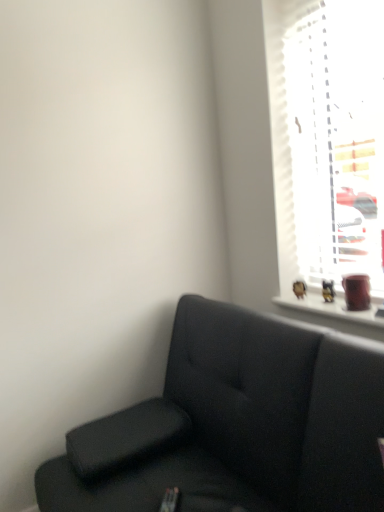
What do you see at coordinates (325, 145) in the screenshot? The height and width of the screenshot is (512, 384). I see `white textured blinds at upper right` at bounding box center [325, 145].

The height and width of the screenshot is (512, 384). I want to click on white textured blinds at upper right, so click(325, 145).

What do you see at coordinates (236, 425) in the screenshot? The height and width of the screenshot is (512, 384). I see `suede black couch at lower right` at bounding box center [236, 425].

Measure the distance between point (225, 342) and camera.

Point (225, 342) is 4.78 feet from camera.

You are a GUI agent. You are given a task and a screenshot of the screen. Output one action in this format:
    pyautogui.click(x=<x>, y=<y>)
    Task: Click on the suede black couch at lower right
    This screenshot has height=512, width=384.
    Given the screenshot: What is the action you would take?
    pyautogui.click(x=236, y=425)

At what (x,y) coordinates should I click in order to perform the action: click on white textured blinds at upper right. Please return your answer as a coordinate pair (x, y). This screenshot has width=384, height=512. Looking at the image, I should click on (325, 145).

Is white textured blinds at upper right to the left of suede black couch at lower right from the viewer's perspective?

In fact, white textured blinds at upper right is to the right of suede black couch at lower right.

Between white textured blinds at upper right and suede black couch at lower right, which one is positioned in front?

Positioned in front is suede black couch at lower right.

Which point is more distant from viewer, (333, 264) or (325, 415)?

Point (333, 264)

From the image's perspective, is white textured blinds at upper right under suede black couch at lower right?

Actually, white textured blinds at upper right appears above suede black couch at lower right in the image.

From a real-world perspective, is white textured blinds at upper right on top of suede black couch at lower right?

Yes, from a real-world perspective, white textured blinds at upper right is over suede black couch at lower right

Is white textured blinds at upper right thinner than suede black couch at lower right?

Indeed, white textured blinds at upper right has a lesser width compared to suede black couch at lower right.

Does white textured blinds at upper right have a greater height compared to suede black couch at lower right?

Indeed, white textured blinds at upper right has a greater height compared to suede black couch at lower right.

Is white textured blinds at upper right bigger or smaller than suede black couch at lower right?

Clearly, white textured blinds at upper right is smaller in size than suede black couch at lower right.

Could suede black couch at lower right be considered to be inside white textured blinds at upper right?

No.

Is white textured blinds at upper right in contact with suede black couch at lower right?

There is a gap between white textured blinds at upper right and suede black couch at lower right.

Is white textured blinds at upper right turned away from suede black couch at lower right?

No, suede black couch at lower right is not at the back of white textured blinds at upper right.

What's the angular difference between white textured blinds at upper right and suede black couch at lower right's facing directions?

The facing directions of white textured blinds at upper right and suede black couch at lower right are 0.0137 degrees apart.

Where is `window lying on the right of suede black couch at lower right`? This screenshot has width=384, height=512. window lying on the right of suede black couch at lower right is located at coordinates (325, 145).

Between suede black couch at lower right and white textured blinds at upper right, which one appears on the left side from the viewer's perspective?

suede black couch at lower right.

Is suede black couch at lower right further to the viewer compared to white textured blinds at upper right?

No, it is in front of white textured blinds at upper right.

Is point (328, 360) closer or farther from the camera than point (379, 278)?

Point (328, 360).

From the image's perspective, is suede black couch at lower right below white textured blinds at upper right?

Yes.

From a real-world perspective, between suede black couch at lower right and white textured blinds at upper right, who is vertically lower?

suede black couch at lower right.

In terms of width, does suede black couch at lower right look wider or thinner when compared to white textured blinds at upper right?

Clearly, suede black couch at lower right has more width compared to white textured blinds at upper right.

Is suede black couch at lower right taller or shorter than white textured blinds at upper right?

Considering their sizes, suede black couch at lower right has less height than white textured blinds at upper right.

Does suede black couch at lower right have a smaller size compared to white textured blinds at upper right?

No, suede black couch at lower right is not smaller than white textured blinds at upper right.

Is suede black couch at lower right outside of white textured blinds at upper right?

Absolutely, suede black couch at lower right is external to white textured blinds at upper right.

Is suede black couch at lower right next to white textured blinds at upper right?

No, suede black couch at lower right is not making contact with white textured blinds at upper right.

In the scene shown: Is suede black couch at lower right oriented away from white textured blinds at upper right?

No, suede black couch at lower right is not facing away from white textured blinds at upper right.

Can you tell me how much suede black couch at lower right and white textured blinds at upper right differ in facing direction?

0.0137 degrees.

Find the location of `studio couch on the left of white textured blinds at upper right`. studio couch on the left of white textured blinds at upper right is located at coordinates point(236,425).

I want to click on window behind the suede black couch at lower right, so click(325, 145).

Identify the location of studio couch below the white textured blinds at upper right (from the image's perspective). (236, 425).